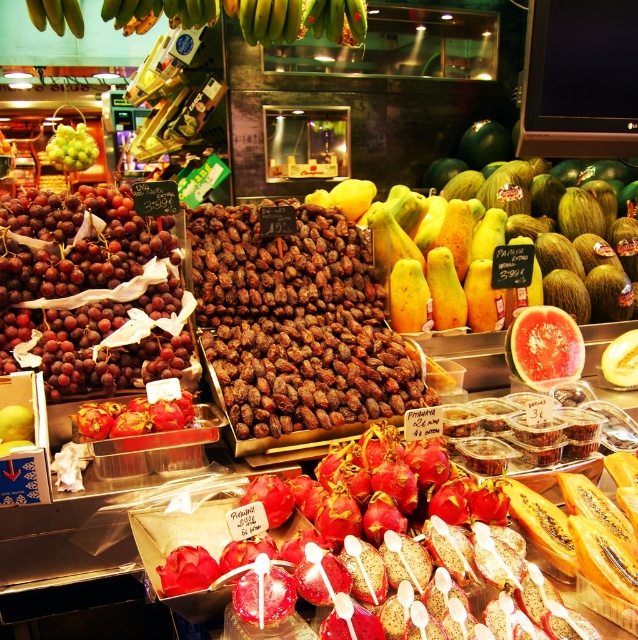
You are a customer at the fruit market stall. You want to pick up both the brown rough dates at center and the green matte bananas at center. How much space do you need to move between them?

The distance between the brown rough dates at center and the green matte bananas at center is 3.51 feet, so you need at least 3.51 feet of space to move between them.

You are standing in front of the fruit market stall and want to take a photo of both point (295, 317) and point (306, 26). Which point should you focus on first to ensure both are in clear view?

You should focus on point (295, 317) first because it is closer to the camera than point (306, 26), ensuring both points are in focus.

Looking at this image, you are a customer at the fruit market stall. You see the watermelon flesh at center and the green matte bananas at center. Which one is located to the right of the other?

The watermelon flesh at center is positioned on the right side of green matte bananas at center.